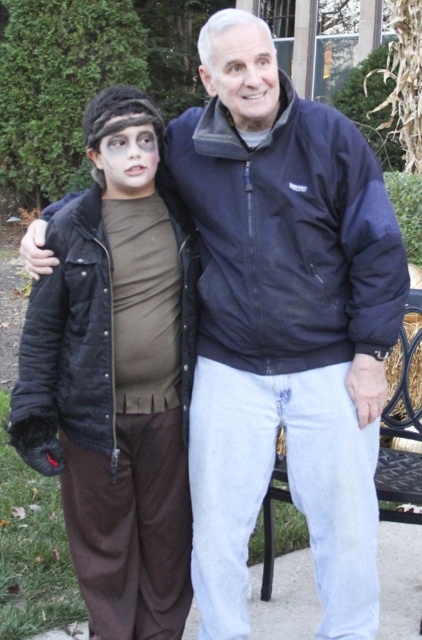
Question: Does matte black jacket at left have a smaller size compared to metallic black bench at lower right?

Choices:
 (A) no
 (B) yes

Answer: (B)

Question: Is matte black jacket at left thinner than metallic black bench at lower right?

Choices:
 (A) yes
 (B) no

Answer: (B)

Question: Which point appears farthest from the camera in this image?

Choices:
 (A) (61, 288)
 (B) (384, 433)

Answer: (B)

Question: Does matte black jacket at left appear on the left side of metallic black bench at lower right?

Choices:
 (A) no
 (B) yes

Answer: (B)